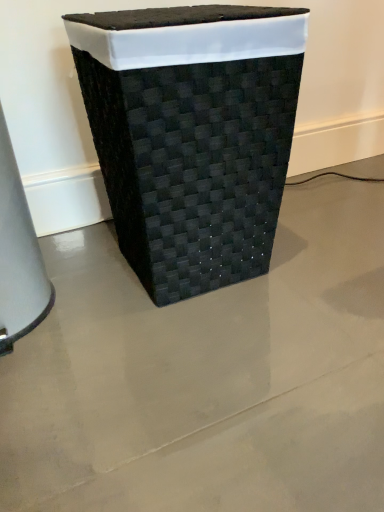
In order to face black woven basket at center, should I rotate leftwards or rightwards?

Turn left by 1.875 degrees to look at black woven basket at center.

What do you see at coordinates (192, 135) in the screenshot? I see `black woven basket at center` at bounding box center [192, 135].

Identify the location of black woven basket at center. The image size is (384, 512). (192, 135).

Find the location of a particular element. black woven basket at center is located at coordinates (192, 135).